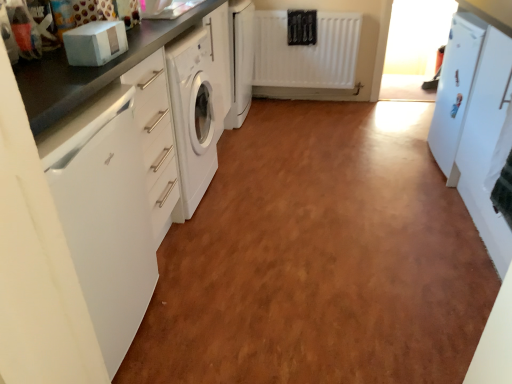
Locate an element on the screen. The width and height of the screenshot is (512, 384). vacant point above white matte radiator at center (from a real-world perspective) is located at coordinates (317, 9).